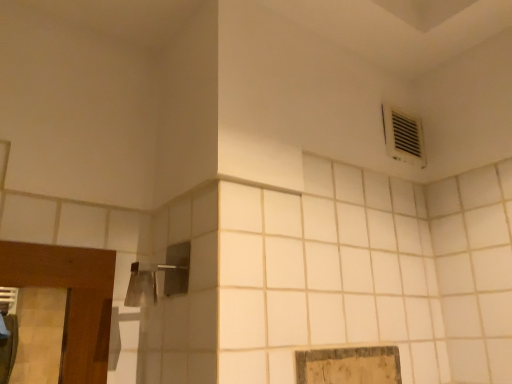
Question: Is brushed metal shower head at upper left facing towards white plastic air conditioning at upper right?

Choices:
 (A) yes
 (B) no

Answer: (B)

Question: Does brushed metal shower head at upper left have a lesser height compared to white plastic air conditioning at upper right?

Choices:
 (A) yes
 (B) no

Answer: (A)

Question: Is brushed metal shower head at upper left wider than white plastic air conditioning at upper right?

Choices:
 (A) no
 (B) yes

Answer: (B)

Question: Can you confirm if brushed metal shower head at upper left is taller than white plastic air conditioning at upper right?

Choices:
 (A) no
 (B) yes

Answer: (A)

Question: From the image's perspective, would you say brushed metal shower head at upper left is shown under white plastic air conditioning at upper right?

Choices:
 (A) yes
 (B) no

Answer: (A)

Question: From a real-world perspective, is brushed metal shower head at upper left located beneath white plastic air conditioning at upper right?

Choices:
 (A) yes
 (B) no

Answer: (A)

Question: Is white plastic air conditioning at upper right positioned with its back to brushed metal shower head at upper left?

Choices:
 (A) no
 (B) yes

Answer: (A)

Question: From a real-world perspective, is white plastic air conditioning at upper right over brushed metal shower head at upper left?

Choices:
 (A) no
 (B) yes

Answer: (B)

Question: Is white plastic air conditioning at upper right closer to camera compared to brushed metal shower head at upper left?

Choices:
 (A) yes
 (B) no

Answer: (B)

Question: Can you confirm if white plastic air conditioning at upper right is bigger than brushed metal shower head at upper left?

Choices:
 (A) yes
 (B) no

Answer: (B)

Question: Is white plastic air conditioning at upper right placed right next to brushed metal shower head at upper left?

Choices:
 (A) no
 (B) yes

Answer: (A)

Question: From the image's perspective, does white plastic air conditioning at upper right appear higher than brushed metal shower head at upper left?

Choices:
 (A) no
 (B) yes

Answer: (B)

Question: From a real-world perspective, relative to white plastic air conditioning at upper right, is brushed metal shower head at upper left vertically above or below?

Choices:
 (A) below
 (B) above

Answer: (A)